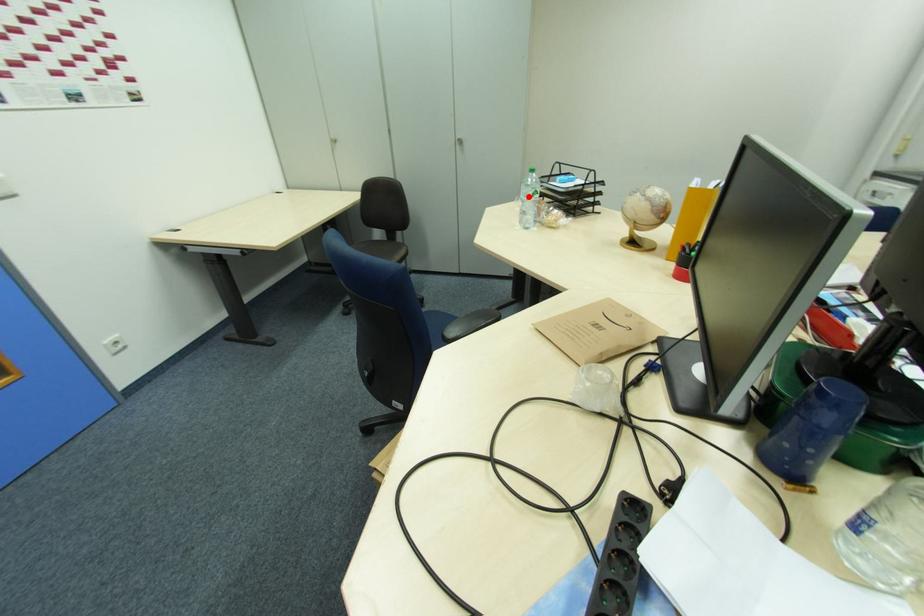
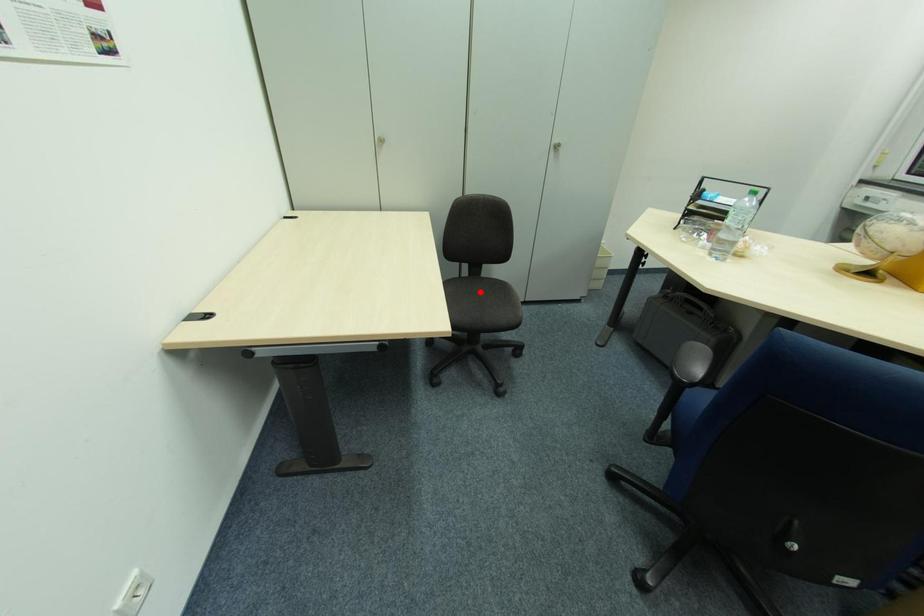
I am providing you with two images of the same scene from different viewpoints. A red point is marked on the first image and another point is marked on the second image. Does the point marked in image1 correspond to the same location as the one in image2?

No